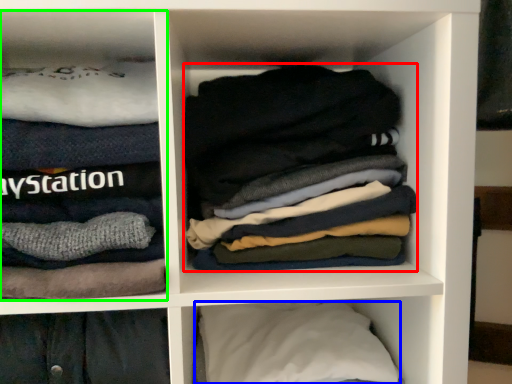
Question: Which object is the farthest from laundry (highlighted by a red box)? Choose among these: pillow (highlighted by a blue box) or cabinet (highlighted by a green box).

Choices:
 (A) pillow
 (B) cabinet

Answer: (A)